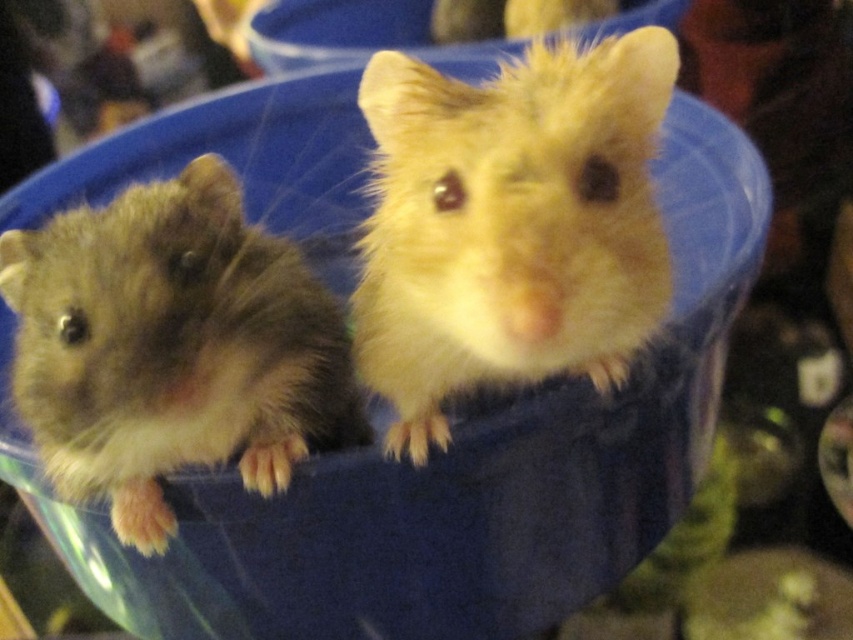
Question: Is fluffy golden hamster at center closer to the viewer compared to fuzzy brown hamster at left?

Choices:
 (A) no
 (B) yes

Answer: (B)

Question: Considering the relative positions of fluffy golden hamster at center and fuzzy brown hamster at left in the image provided, where is fluffy golden hamster at center located with respect to fuzzy brown hamster at left?

Choices:
 (A) left
 (B) right

Answer: (B)

Question: Which point is farther to the camera?

Choices:
 (A) fluffy golden hamster at center
 (B) fuzzy brown hamster at left

Answer: (B)

Question: Which point is farther to the camera?

Choices:
 (A) coord(225,282)
 (B) coord(613,97)

Answer: (A)

Question: Does fluffy golden hamster at center have a smaller size compared to fuzzy brown hamster at left?

Choices:
 (A) yes
 (B) no

Answer: (A)

Question: Which of the following is the closest to the observer?

Choices:
 (A) fluffy golden hamster at center
 (B) fuzzy brown hamster at left

Answer: (A)